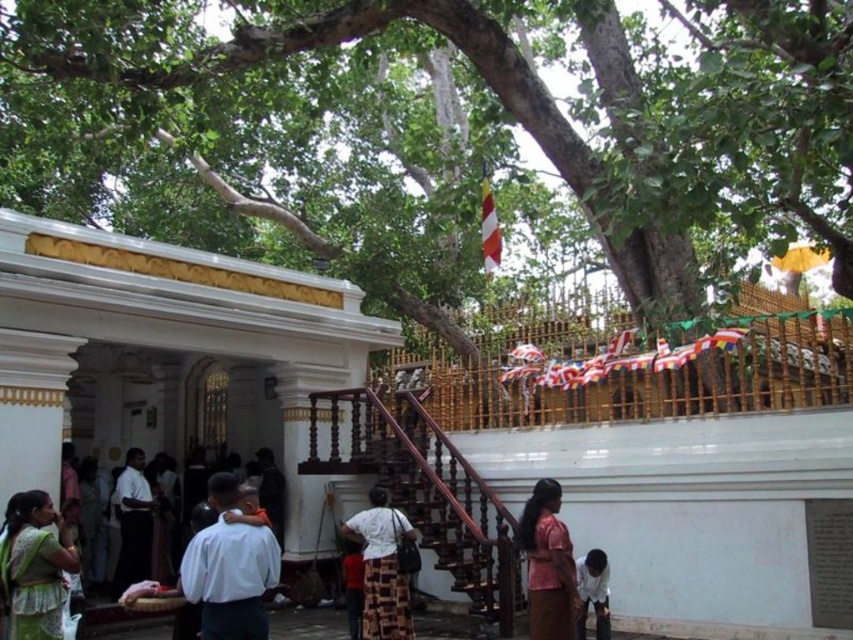
You are standing at the entrance of the white building with traditional architectural features and want to walk towards the large tree with sprawling branches. Which point, point (54, 568) or point (125, 506), is closer to your current position?

Point (54, 568) is closer to your current position at the entrance of the white building with traditional architectural features because it is in front of point (125, 506).

You are a photographer planning to take a group photo of two people wearing the white shirt at center and the dark gray shirt at center. You want to ensure both shirts are visible in the frame. Which shirt should you position closer to the camera to avoid overlapping?

The white shirt at center has a larger width than the dark gray shirt at center, so positioning the white shirt at center further away from the camera and the dark gray shirt at center closer would prevent overlap while accommodating their sizes.

You are a visitor at this temple and want to take a photo of both the dark gray shirt at center and the white matte shirt at lower right. Which one should you focus on first to ensure both are in focus?

You should focus on the dark gray shirt at center first because it is closer to you than the white matte shirt at lower right, so adjusting focus starting from the closer object will help both be in focus.